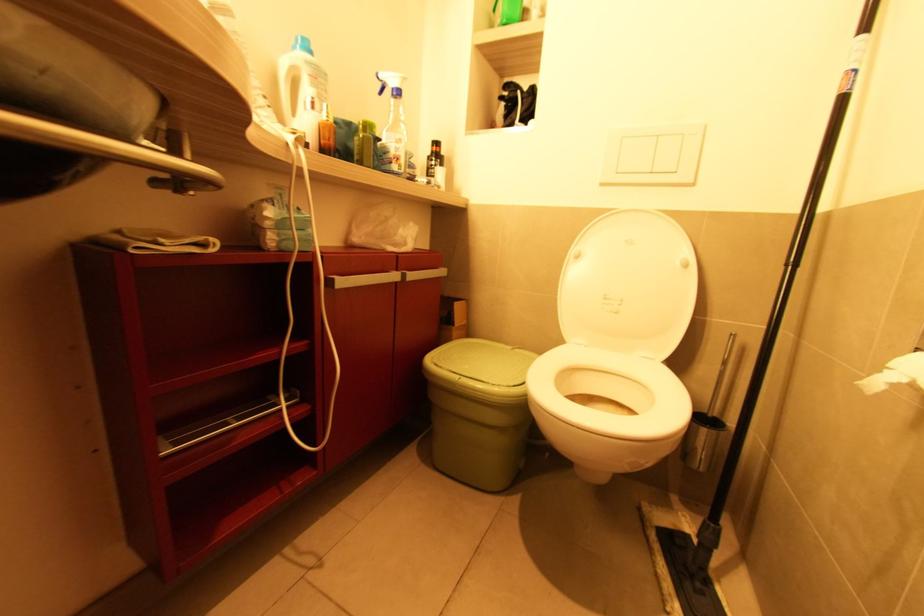
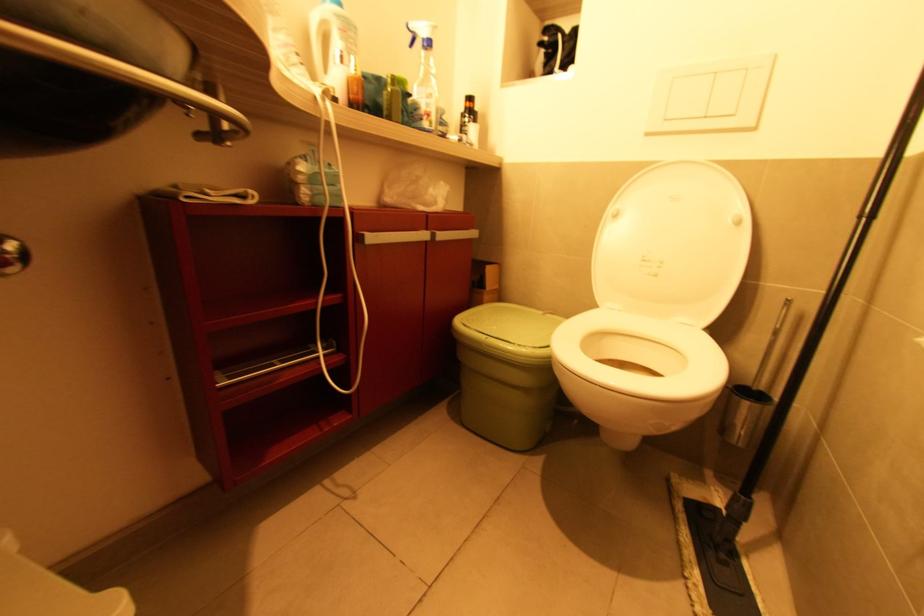
Question: Based on the continuous images, in which direction is the camera rotating? Reply with the corresponding letter.

Choices:
 (A) Left
 (B) Right
 (C) Up
 (D) Down

Answer: (A)